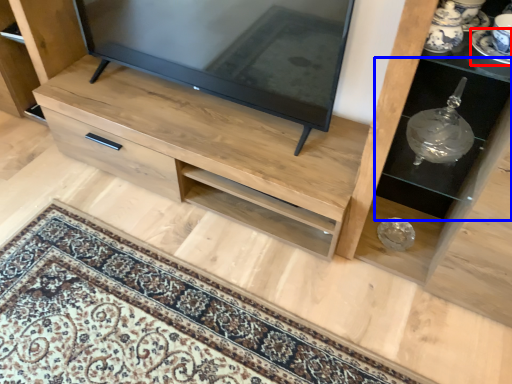
Question: Which point is further to the camera, saucer (highlighted by a red box) or shelf (highlighted by a blue box)?

Choices:
 (A) saucer
 (B) shelf

Answer: (B)